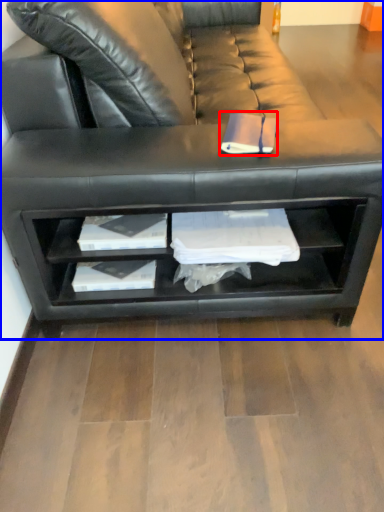
Question: Which object is closer to the camera taking this photo, book (highlighted by a red box) or studio couch (highlighted by a blue box)?

Choices:
 (A) book
 (B) studio couch

Answer: (B)